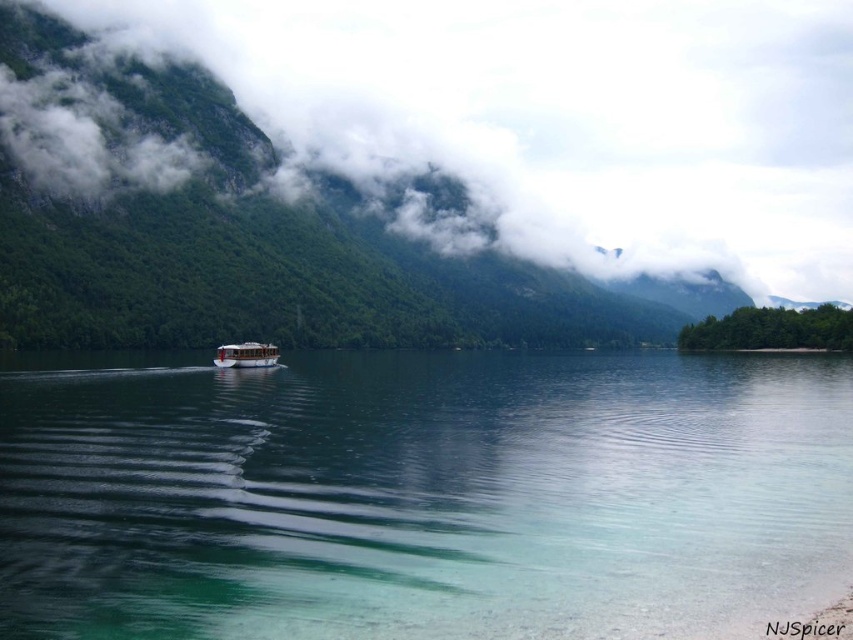
Question: Which point is closer to the camera?

Choices:
 (A) clear water at center
 (B) white wooden boat at center

Answer: (A)

Question: Does clear water at center have a larger size compared to white wooden boat at center?

Choices:
 (A) no
 (B) yes

Answer: (B)

Question: Which of the following is the farthest from the observer?

Choices:
 (A) clear water at center
 (B) white fluffy cloud at upper center

Answer: (B)

Question: Is clear water at center positioned behind white wooden boat at center?

Choices:
 (A) yes
 (B) no

Answer: (B)

Question: In this image, where is clear water at center located relative to white wooden boat at center?

Choices:
 (A) right
 (B) left

Answer: (A)

Question: Which point is closer to the camera?

Choices:
 (A) white fluffy cloud at upper center
 (B) clear water at center
 (C) white wooden boat at center

Answer: (B)